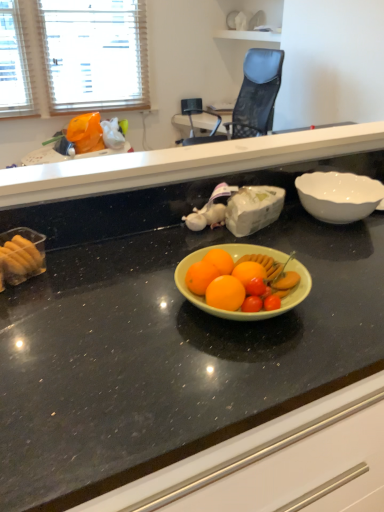
Question: Is white glossy bowl at right in front of or behind blue mesh chair at upper center in the image?

Choices:
 (A) behind
 (B) front

Answer: (B)

Question: Considering the positions of point [x=307, y=207] and point [x=258, y=132], is point [x=307, y=207] closer or farther from the camera than point [x=258, y=132]?

Choices:
 (A) closer
 (B) farther

Answer: (A)

Question: Estimate the real-world distances between objects in this image. Which object is farther from the black granite countertop at center, the 2th countertop when ordered from bottom to top?

Choices:
 (A) green matte bowl at center, which is counted as the second countertop, starting from the top
 (B) white glossy bowl at right
 (C) blue mesh chair at upper center

Answer: (C)

Question: Estimate the real-world distances between objects in this image. Which object is farther from the blue mesh chair at upper center?

Choices:
 (A) green matte bowl at center, the 1th countertop when ordered from bottom to top
 (B) white glossy bowl at right
 (C) black granite countertop at center, the 2th countertop when ordered from bottom to top

Answer: (A)